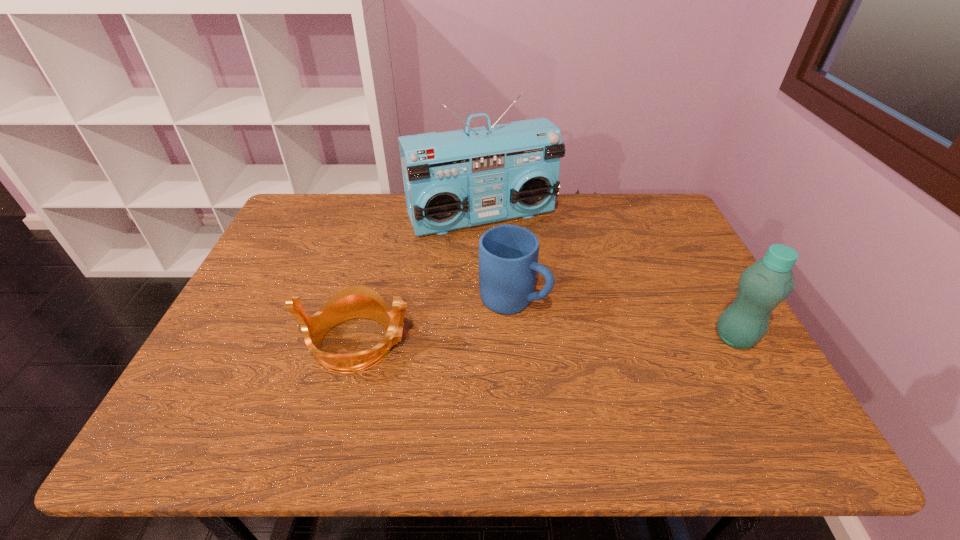
In the image, there is a desktop. Where is `free space at the far left corner`? The image size is (960, 540). free space at the far left corner is located at coordinates (301, 197).

Where is `vacant space at the near left corner of the desktop`? This screenshot has width=960, height=540. vacant space at the near left corner of the desktop is located at coordinates (252, 369).

Find the location of a particular element. Image resolution: width=960 pixels, height=540 pixels. vacant space at the far right corner of the desktop is located at coordinates coord(646,213).

What are the coordinates of `free space at the near right corner` in the screenshot? It's located at (737, 380).

The height and width of the screenshot is (540, 960). Identify the location of free space between the mug and the tiara. (435, 321).

Find the location of a particular element. Image resolution: width=960 pixels, height=540 pixels. free spot between the second tallest object and the radio receiver is located at coordinates (609, 278).

This screenshot has height=540, width=960. I want to click on free space between the third tallest object and the shortest object, so click(x=435, y=321).

Where is `free point between the third tallest object and the tiara`? Image resolution: width=960 pixels, height=540 pixels. free point between the third tallest object and the tiara is located at coordinates (435, 321).

The width and height of the screenshot is (960, 540). Find the location of `blank region between the tiara and the farthest object`. blank region between the tiara and the farthest object is located at coordinates (420, 280).

Find the location of a particular element. vacant space in between the mug and the second tallest object is located at coordinates (624, 319).